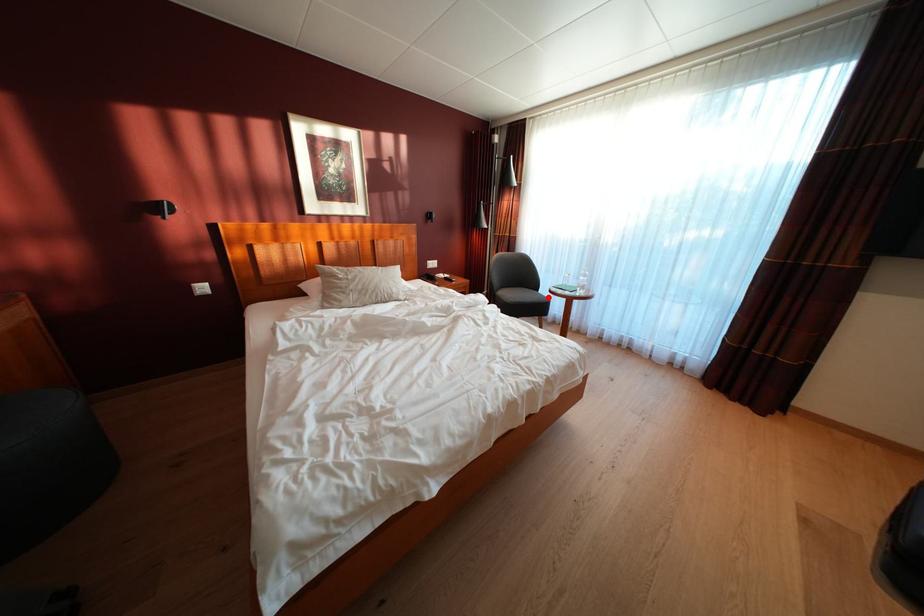
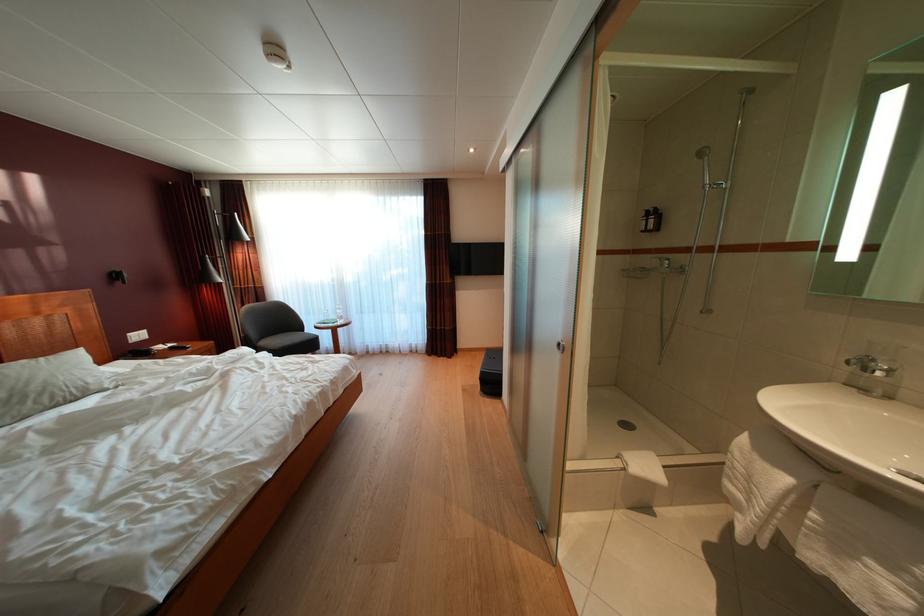
Question: I am providing you with two images of the same scene from different viewpoints. In image1, a red point is highlighted. Considering the same 3D point in image2, which of the following is correct?

Choices:
 (A) It is closer
 (B) It is farther

Answer: (B)